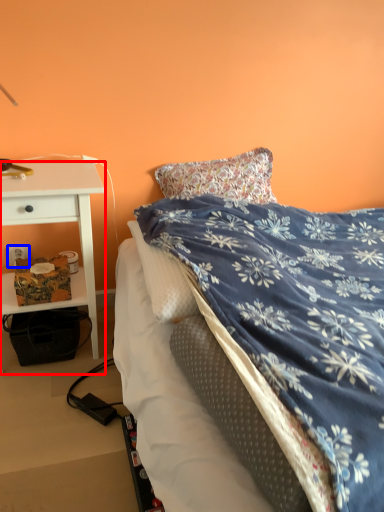
Question: Which point is closer to the camera, desk (highlighted by a red box) or power outlet (highlighted by a blue box)?

Choices:
 (A) desk
 (B) power outlet

Answer: (A)